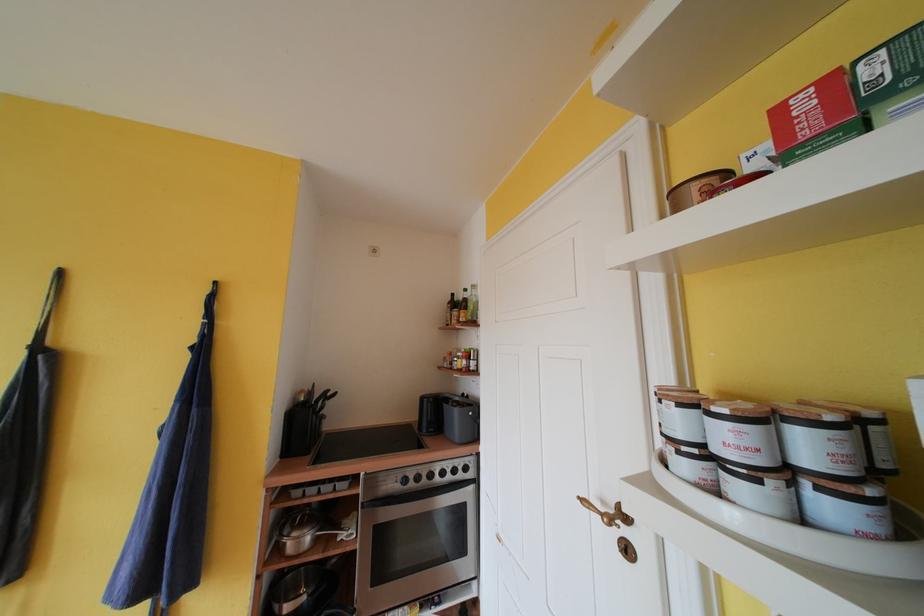
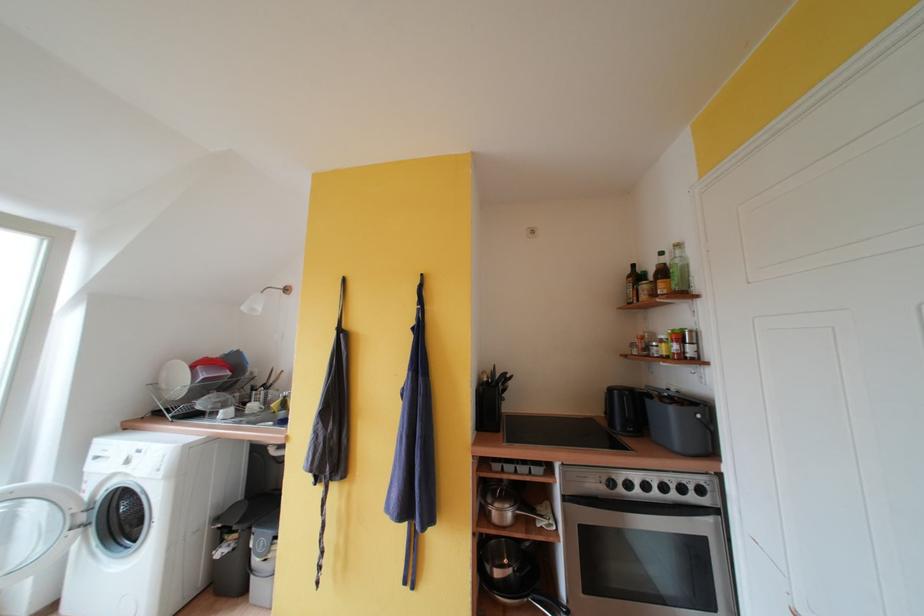
Locate, in the second image, the point that corresponds to [472,299] in the first image.

(671, 262)